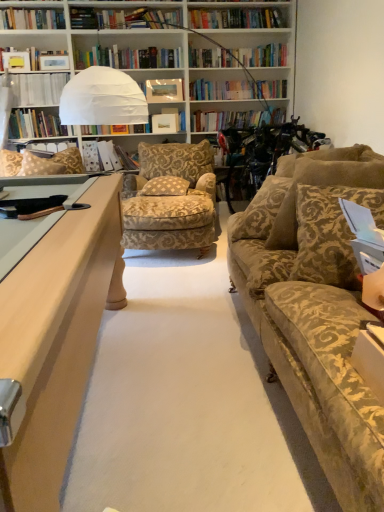
Question: Considering the positions of transparent plastic book at upper left, the second book in the right-to-left sequence, and patterned fabric pillow at center, arranged as the 2th pillow when viewed from the left, in the image, is transparent plastic book at upper left, the second book in the right-to-left sequence, taller or shorter than patterned fabric pillow at center, arranged as the 2th pillow when viewed from the left,?

Choices:
 (A) short
 (B) tall

Answer: (B)

Question: In terms of width, does transparent plastic book at upper left, acting as the 1th book starting from the left, look wider or thinner when compared to patterned fabric pillow at center, the 3th pillow viewed from the right?

Choices:
 (A) wide
 (B) thin

Answer: (B)

Question: Which object is the farthest from the transparent plastic book at upper left, the second book in the right-to-left sequence?

Choices:
 (A) matte white photo frame at center
 (B) matte white folder at center, which appears as the 2th book when viewed from the top
 (C) patterned fabric pillow at left, the 4th pillow when ordered from right to left
 (D) patterned fabric pillow at center, arranged as the 2th pillow when viewed from the back
 (E) brown textured pillow at right, the 3th pillow from the back

Answer: (E)

Question: Which of these objects is positioned farthest from the gold damask pillow at right, the 3th pillow positioned from the left?

Choices:
 (A) matte white photo frame at center
 (B) patterned fabric pillow at left, which is counted as the 4th pillow, starting from the front
 (C) transparent plastic book at upper left, the second book in the right-to-left sequence
 (D) patterned fabric pillow at center, the 3th pillow viewed from the right
 (E) matte white folder at center, which ranks as the 1th book in right-to-left order

Answer: (C)